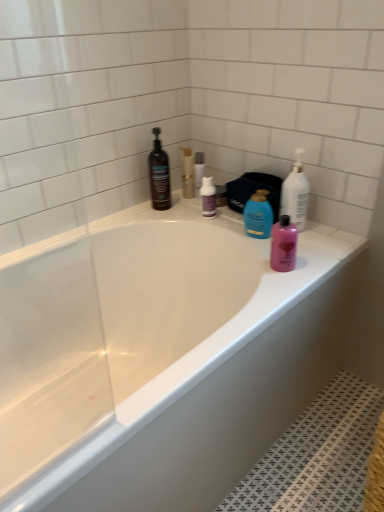
In order to click on unoccupied area in front of matte black bottle at upper left, which is the 1th cleaning product from left to right in this screenshot , I will do pos(158,220).